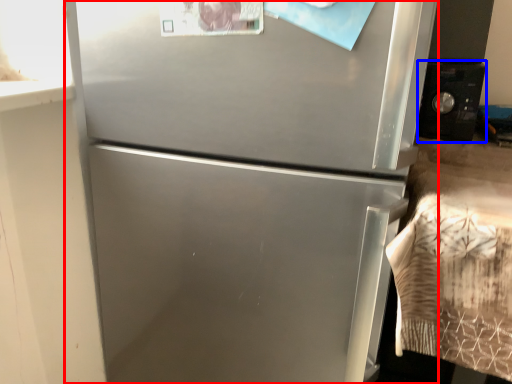
Question: Which point is further to the camera, refrigerator (highlighted by a red box) or appliance (highlighted by a blue box)?

Choices:
 (A) refrigerator
 (B) appliance

Answer: (B)